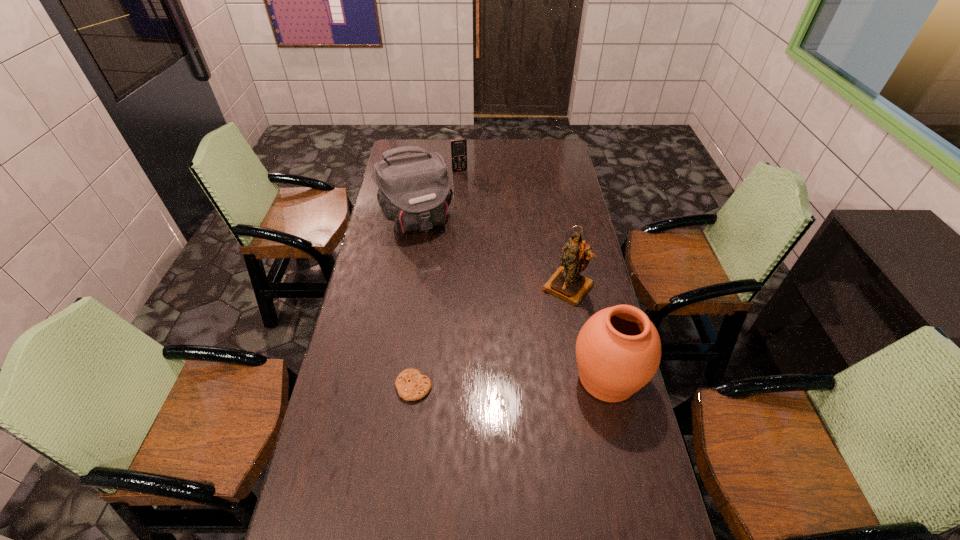
Where is `vacant area that lies between the urn and the farthest object`? vacant area that lies between the urn and the farthest object is located at coordinates (534, 274).

Find the location of `vacant space that is in between the second farthest object and the urn`. vacant space that is in between the second farthest object and the urn is located at coordinates (512, 299).

Identify the location of vacant region between the urn and the cookie. The width and height of the screenshot is (960, 540). (x=511, y=382).

The image size is (960, 540). I want to click on free spot between the shoulder bag and the figurine, so click(492, 253).

Locate an element on the screen. This screenshot has height=540, width=960. free space between the shortest object and the urn is located at coordinates (511, 382).

Point out which object is positioned as the third nearest to the urn. Please provide its 2D coordinates. Your answer should be formatted as a tuple, i.e. [(x, y)], where the tuple contains the x and y coordinates of a point satisfying the conditions above.

[(414, 191)]

In order to click on object identified as the second closest to the urn in this screenshot , I will do `click(411, 385)`.

I want to click on vacant region that satisfies the following two spatial constraints: 1. on the back side of the figurine; 2. on the left side of the cookie, so click(x=425, y=287).

Find the location of a particular element. free region that satisfies the following two spatial constraints: 1. on the front side of the cookie; 2. on the left side of the shoulder bag is located at coordinates (391, 387).

At what (x,y) coordinates should I click in order to perform the action: click on vacant space that satisfies the following two spatial constraints: 1. on the back side of the second shortest object; 2. on the right side of the shortest object. Please return your answer as a coordinate pair (x, y). Looking at the image, I should click on (439, 171).